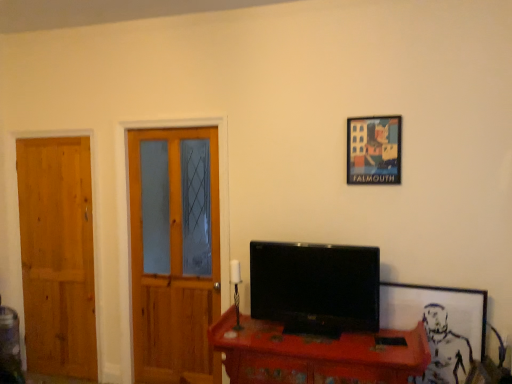
Question: In terms of width, does wooden desk at center look wider or thinner when compared to white matte picture frame at right, positioned as the 1th picture frame in right-to-left order?

Choices:
 (A) wide
 (B) thin

Answer: (A)

Question: From a real-world perspective, is wooden desk at center above or below white matte picture frame at right, positioned as the 1th picture frame in right-to-left order?

Choices:
 (A) above
 (B) below

Answer: (B)

Question: Which of these objects is positioned farthest from the black glossy tv at center?

Choices:
 (A) natural wood door at left, placed as the first door when sorted from left to right
 (B) wooden desk at center
 (C) wooden door at left, placed as the first door when sorted from right to left
 (D) matte plastic picture frame at upper right, positioned as the 1th picture frame in top-to-bottom order
 (E) white matte picture frame at right, the second picture frame positioned from the top

Answer: (A)

Question: Estimate the real-world distances between objects in this image. Which object is closer to the matte plastic picture frame at upper right, the second picture frame positioned from the right?

Choices:
 (A) natural wood door at left, placed as the first door when sorted from left to right
 (B) wooden door at left, the 2th door in the left-to-right sequence
 (C) white matte picture frame at right, positioned as the 1th picture frame in right-to-left order
 (D) black glossy tv at center
 (E) wooden desk at center

Answer: (D)